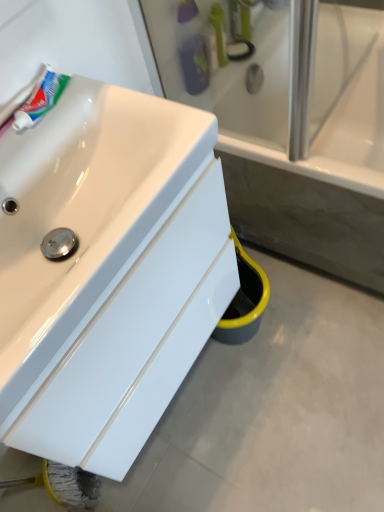
Question: Can you confirm if white glossy sink at lower left is bigger than white ceramic bathtub at center?

Choices:
 (A) yes
 (B) no

Answer: (B)

Question: Can you confirm if white glossy sink at lower left is positioned to the left of white ceramic bathtub at center?

Choices:
 (A) no
 (B) yes

Answer: (B)

Question: Is white glossy sink at lower left thinner than white ceramic bathtub at center?

Choices:
 (A) yes
 (B) no

Answer: (A)

Question: Is white glossy sink at lower left taller than white ceramic bathtub at center?

Choices:
 (A) no
 (B) yes

Answer: (B)

Question: From a real-world perspective, is white glossy sink at lower left positioned under white ceramic bathtub at center based on gravity?

Choices:
 (A) yes
 (B) no

Answer: (B)

Question: From the image's perspective, is white glossy sink at lower left beneath white ceramic bathtub at center?

Choices:
 (A) yes
 (B) no

Answer: (A)

Question: Considering the relative sizes of translucent plastic toothbrush at upper center, which is the second toiletry from right to left, and white ceramic bathtub at center in the image provided, is translucent plastic toothbrush at upper center, which is the second toiletry from right to left, bigger than white ceramic bathtub at center?

Choices:
 (A) yes
 (B) no

Answer: (B)

Question: Is translucent plastic toothbrush at upper center, the 2th toiletry from the top, next to white ceramic bathtub at center?

Choices:
 (A) yes
 (B) no

Answer: (B)

Question: Is translucent plastic toothbrush at upper center, placed as the 1th toiletry when sorted from bottom to top, oriented away from white ceramic bathtub at center?

Choices:
 (A) no
 (B) yes

Answer: (A)

Question: Does translucent plastic toothbrush at upper center, which is the second toiletry from right to left, have a greater width compared to white ceramic bathtub at center?

Choices:
 (A) no
 (B) yes

Answer: (A)

Question: Can you confirm if translucent plastic toothbrush at upper center, which ranks as the 1th toiletry in left-to-right order, is thinner than white ceramic bathtub at center?

Choices:
 (A) no
 (B) yes

Answer: (B)

Question: Is translucent plastic toothbrush at upper center, placed as the 1th toiletry when sorted from bottom to top, not close to white ceramic bathtub at center?

Choices:
 (A) no
 (B) yes

Answer: (A)

Question: Does white ceramic bathtub at center appear on the left side of white glossy tube at upper left?

Choices:
 (A) yes
 (B) no

Answer: (B)